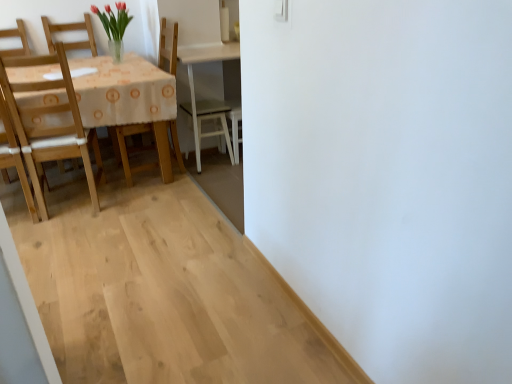
Image resolution: width=512 pixels, height=384 pixels. I want to click on wooden chair at left, placed as the first chair when sorted from right to left, so click(x=148, y=147).

The height and width of the screenshot is (384, 512). What do you see at coordinates (148, 147) in the screenshot? I see `wooden chair at left, placed as the first chair when sorted from right to left` at bounding box center [148, 147].

Measure the distance between point (168,168) and camera.

Point (168,168) and camera are 3.02 meters apart.

Describe the element at coordinates (14, 155) in the screenshot. The width and height of the screenshot is (512, 384). I see `light wood chair at left, placed as the 1th chair when sorted from left to right` at that location.

The image size is (512, 384). In order to click on light wood chair at left, which ranks as the 2th chair in right-to-left order in this screenshot , I will do `click(14, 155)`.

Measure the distance between light wood chair at left, which ranks as the 2th chair in right-to-left order, and camera.

2.29 meters.

What are the coordinates of `wooden chair at left, placed as the first chair when sorted from right to left` in the screenshot? It's located at (148, 147).

Considering the relative positions of wooden chair at left, placed as the first chair when sorted from right to left, and light wood chair at left, placed as the 1th chair when sorted from left to right, in the image provided, is wooden chair at left, placed as the first chair when sorted from right to left, to the left of light wood chair at left, placed as the 1th chair when sorted from left to right, from the viewer's perspective?

No, wooden chair at left, placed as the first chair when sorted from right to left, is not to the left of light wood chair at left, placed as the 1th chair when sorted from left to right.

Considering their positions, is wooden chair at left, the 2th chair from the left, located in front of or behind light wood chair at left, which ranks as the 2th chair in right-to-left order?

Visually, wooden chair at left, the 2th chair from the left, is located behind light wood chair at left, which ranks as the 2th chair in right-to-left order.

Is point (167, 177) farther from camera compared to point (32, 194)?

Yes, point (167, 177) is behind point (32, 194).

From the image's perspective, which is below, wooden chair at left, the 2th chair from the left, or light wood chair at left, which ranks as the 2th chair in right-to-left order?

light wood chair at left, which ranks as the 2th chair in right-to-left order, appears lower in the image.

From a real-world perspective, is wooden chair at left, the 2th chair from the left, under light wood chair at left, which ranks as the 2th chair in right-to-left order?

No, from a real-world perspective, wooden chair at left, the 2th chair from the left, is not under light wood chair at left, which ranks as the 2th chair in right-to-left order.

Which object is wider, wooden chair at left, the 2th chair from the left, or light wood chair at left, which ranks as the 2th chair in right-to-left order?

Wider between the two is light wood chair at left, which ranks as the 2th chair in right-to-left order.

Considering the relative sizes of wooden chair at left, placed as the first chair when sorted from right to left, and light wood chair at left, placed as the 1th chair when sorted from left to right, in the image provided, is wooden chair at left, placed as the first chair when sorted from right to left, taller than light wood chair at left, placed as the 1th chair when sorted from left to right,?

Indeed, wooden chair at left, placed as the first chair when sorted from right to left, has a greater height compared to light wood chair at left, placed as the 1th chair when sorted from left to right.

Consider the image. Can you confirm if wooden chair at left, placed as the first chair when sorted from right to left, is bigger than light wood chair at left, placed as the 1th chair when sorted from left to right?

Indeed, wooden chair at left, placed as the first chair when sorted from right to left, has a larger size compared to light wood chair at left, placed as the 1th chair when sorted from left to right.

Is light wood chair at left, placed as the 1th chair when sorted from left to right, inside wooden chair at left, placed as the first chair when sorted from right to left?

No.

Is wooden chair at left, the 2th chair from the left, positioned far away from light wood chair at left, which ranks as the 2th chair in right-to-left order?

No.

Does wooden chair at left, the 2th chair from the left, turn towards light wood chair at left, placed as the 1th chair when sorted from left to right?

Yes, wooden chair at left, the 2th chair from the left, is aimed at light wood chair at left, placed as the 1th chair when sorted from left to right.

How distant is wooden chair at left, placed as the first chair when sorted from right to left, from light wood chair at left, placed as the 1th chair when sorted from left to right?

wooden chair at left, placed as the first chair when sorted from right to left, is 31.22 inches away from light wood chair at left, placed as the 1th chair when sorted from left to right.

The width and height of the screenshot is (512, 384). I want to click on chair below the wooden chair at left, placed as the first chair when sorted from right to left (from the image's perspective), so (x=14, y=155).

Which object is positioned more to the right, light wood chair at left, placed as the 1th chair when sorted from left to right, or wooden chair at left, the 2th chair from the left?

From the viewer's perspective, wooden chair at left, the 2th chair from the left, appears more on the right side.

Considering their positions, is light wood chair at left, which ranks as the 2th chair in right-to-left order, located in front of or behind wooden chair at left, placed as the first chair when sorted from right to left?

Clearly, light wood chair at left, which ranks as the 2th chair in right-to-left order, is in front of wooden chair at left, placed as the first chair when sorted from right to left.

Between point (27, 198) and point (176, 144), which one is positioned in front?

The point (27, 198) is more forward.

From the image's perspective, between light wood chair at left, which ranks as the 2th chair in right-to-left order, and wooden chair at left, placed as the first chair when sorted from right to left, who is located below?

light wood chair at left, which ranks as the 2th chair in right-to-left order.

From a real-world perspective, is light wood chair at left, placed as the 1th chair when sorted from left to right, positioned over wooden chair at left, placed as the first chair when sorted from right to left, based on gravity?

No, from a real-world perspective, light wood chair at left, placed as the 1th chair when sorted from left to right, is not above wooden chair at left, placed as the first chair when sorted from right to left.

Is light wood chair at left, which ranks as the 2th chair in right-to-left order, wider than wooden chair at left, placed as the first chair when sorted from right to left?

Indeed, light wood chair at left, which ranks as the 2th chair in right-to-left order, has a greater width compared to wooden chair at left, placed as the first chair when sorted from right to left.

Does light wood chair at left, which ranks as the 2th chair in right-to-left order, have a lesser height compared to wooden chair at left, placed as the first chair when sorted from right to left?

Correct, light wood chair at left, which ranks as the 2th chair in right-to-left order, is not as tall as wooden chair at left, placed as the first chair when sorted from right to left.

Is light wood chair at left, placed as the 1th chair when sorted from left to right, bigger than wooden chair at left, the 2th chair from the left?

No, light wood chair at left, placed as the 1th chair when sorted from left to right, is not bigger than wooden chair at left, the 2th chair from the left.

Would you say wooden chair at left, the 2th chair from the left, is part of light wood chair at left, placed as the 1th chair when sorted from left to right,'s contents?

No, wooden chair at left, the 2th chair from the left, is located outside of light wood chair at left, placed as the 1th chair when sorted from left to right.

Is light wood chair at left, which ranks as the 2th chair in right-to-left order, far away from wooden chair at left, the 2th chair from the left?

That's not correct — light wood chair at left, which ranks as the 2th chair in right-to-left order, is a little close to wooden chair at left, the 2th chair from the left.

Could you tell me if light wood chair at left, placed as the 1th chair when sorted from left to right, is turned towards wooden chair at left, placed as the first chair when sorted from right to left?

No.

How different are the orientations of light wood chair at left, which ranks as the 2th chair in right-to-left order, and wooden chair at left, the 2th chair from the left, in degrees?

88.5 degrees.

Locate an element on the screen. This screenshot has width=512, height=384. chair above the light wood chair at left, which ranks as the 2th chair in right-to-left order (from a real-world perspective) is located at coordinates (148, 147).

Image resolution: width=512 pixels, height=384 pixels. What are the coordinates of `chair in front of the wooden chair at left, the 2th chair from the left` in the screenshot? It's located at (14, 155).

This screenshot has height=384, width=512. Identify the location of chair located above the light wood chair at left, placed as the 1th chair when sorted from left to right (from the image's perspective). (148, 147).